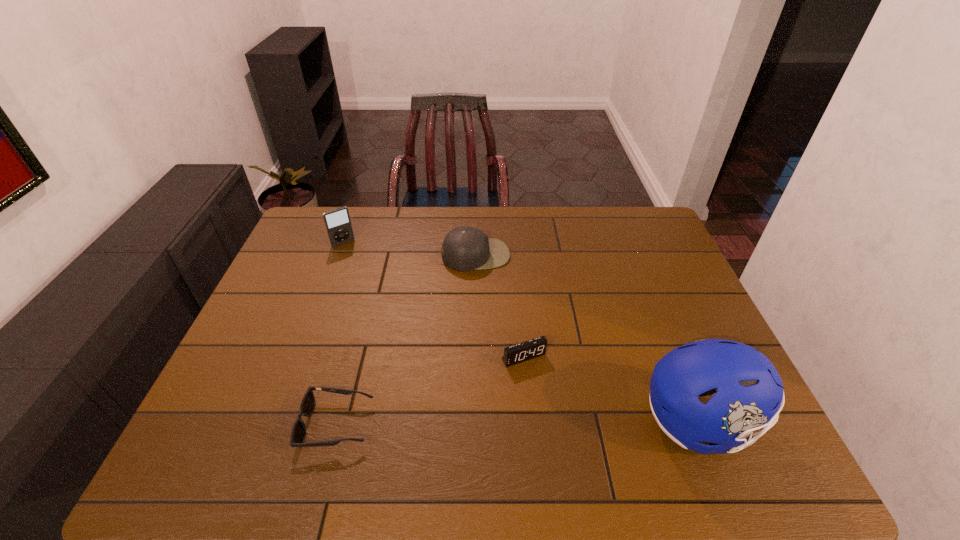
At what (x,y) coordinates should I click in order to perform the action: click on iPod that is at the far edge. Please return your answer as a coordinate pair (x, y). Looking at the image, I should click on (338, 224).

Find the location of `cap at the far edge`. cap at the far edge is located at coordinates (466, 248).

Where is `sunglasses located in the near edge section of the desktop`? sunglasses located in the near edge section of the desktop is located at coordinates (307, 405).

Locate an element on the screen. The height and width of the screenshot is (540, 960). football helmet that is positioned at the near edge is located at coordinates 750,392.

Find the location of `object positioned at the left edge`. object positioned at the left edge is located at coordinates (338, 224).

Where is `object that is at the right edge`? The width and height of the screenshot is (960, 540). object that is at the right edge is located at coordinates (750, 392).

Identify the location of object that is at the far left corner. This screenshot has width=960, height=540. (338, 224).

You are a GUI agent. You are given a task and a screenshot of the screen. Output one action in this format:
    pyautogui.click(x=<x>, y=<y>)
    Task: Click on the object present at the near right corner
    
    Given the screenshot: What is the action you would take?
    pyautogui.click(x=750, y=392)

This screenshot has height=540, width=960. In order to click on vacant space at the far edge in this screenshot , I will do [x=559, y=211].

At what (x,y) coordinates should I click in order to perform the action: click on blank space at the near edge. Please return your answer as a coordinate pair (x, y). The width and height of the screenshot is (960, 540). Looking at the image, I should click on (451, 399).